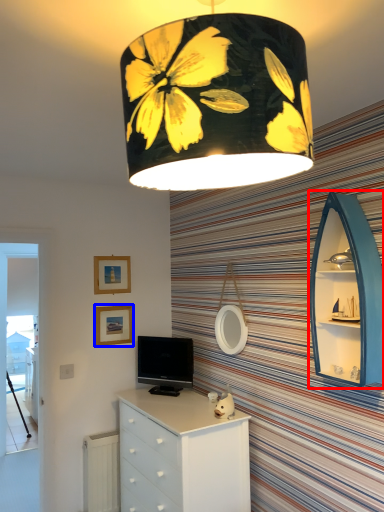
Question: Which point is further to the camera, shelf (highlighted by a red box) or picture frame (highlighted by a blue box)?

Choices:
 (A) shelf
 (B) picture frame

Answer: (B)